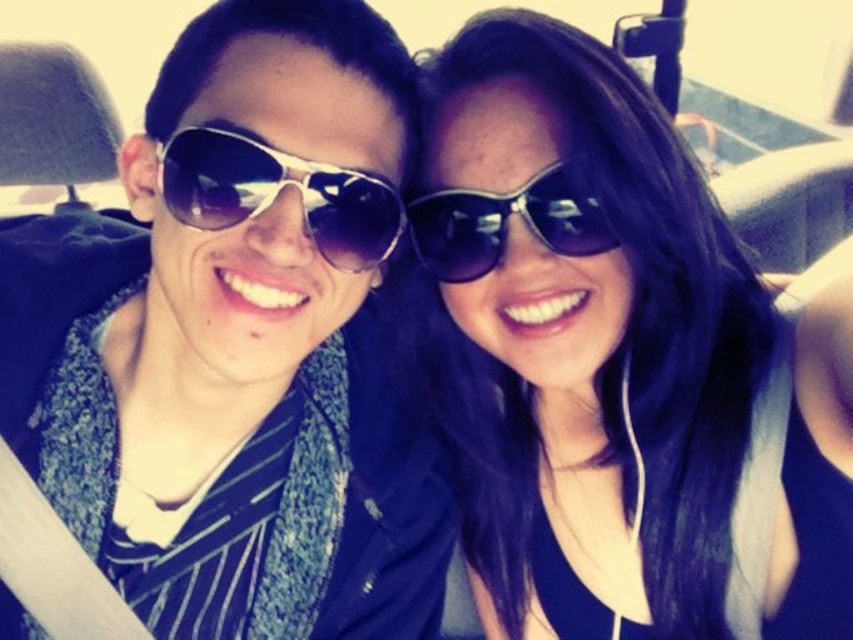
Question: Which point appears closest to the camera in this image?

Choices:
 (A) (566, 188)
 (B) (824, 557)

Answer: (A)

Question: Observing the image, what is the correct spatial positioning of metallic aviator sunglasses at left in reference to metallic reflective sunglasses at center?

Choices:
 (A) below
 (B) above

Answer: (A)

Question: Estimate the real-world distances between objects in this image. Which object is closer to the metallic reflective sunglasses at center?

Choices:
 (A) metallic aviator sunglasses at left
 (B) shiny black sunglasses at center

Answer: (B)

Question: Considering the real-world distances, which object is closest to the shiny black sunglasses at center?

Choices:
 (A) matte black sunglasses at upper center
 (B) metallic reflective sunglasses at center
 (C) metallic aviator sunglasses at left

Answer: (B)

Question: Is matte black sunglasses at upper center to the left of metallic reflective sunglasses at center from the viewer's perspective?

Choices:
 (A) no
 (B) yes

Answer: (A)

Question: Is metallic aviator sunglasses at left positioned before shiny black sunglasses at center?

Choices:
 (A) yes
 (B) no

Answer: (A)